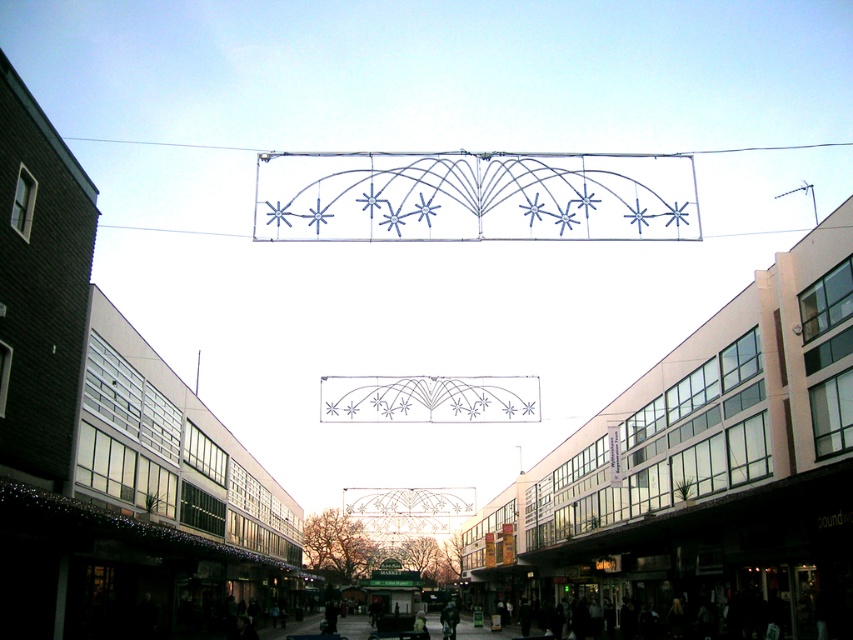
Can you confirm if metallic glass building at center is shorter than metallic wireframe at upper center?

No.

Is point (682, 576) positioned before point (84, 582)?

No, it is behind (84, 582).

Locate an element on the screen. metallic glass building at center is located at coordinates (706, 472).